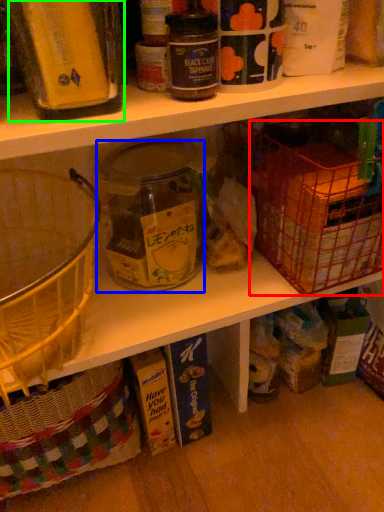
Question: Which object is the farthest from basket (highlighted by a red box)? Choose among these: glass jar (highlighted by a blue box) or bottle (highlighted by a green box).

Choices:
 (A) glass jar
 (B) bottle

Answer: (B)